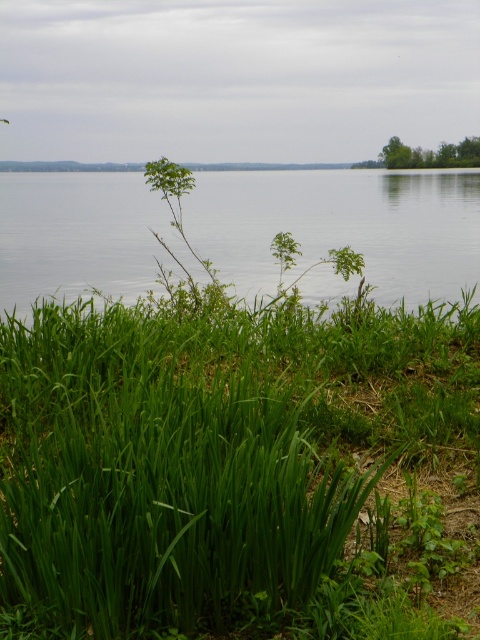
Which is above, green leafy grass at lower left or transparent water at center?

Positioned higher is transparent water at center.

Find the location of a particular element. The height and width of the screenshot is (640, 480). green leafy grass at lower left is located at coordinates (227, 460).

Does point (247, 515) come closer to viewer compared to point (1, 182)?

That is True.

I want to click on green leafy grass at lower left, so click(227, 460).

Is point (399, 205) farther from viewer compared to point (393, 138)?

No.

The height and width of the screenshot is (640, 480). I want to click on transparent water at center, so click(343, 227).

Which is in front, point (13, 499) or point (452, 154)?

Point (13, 499) is in front.

Is green leafy grass at lower left below green grass at upper right?

Indeed, green leafy grass at lower left is positioned under green grass at upper right.

At what (x,y) coordinates should I click in order to perform the action: click on green leafy grass at lower left. Please return your answer as a coordinate pair (x, y). The image size is (480, 640). Looking at the image, I should click on (227, 460).